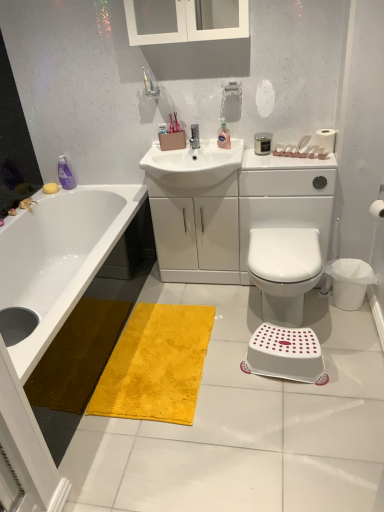
What are the coordinates of `free spot to the right of white plastic step stool at lower center` in the screenshot? It's located at (354, 356).